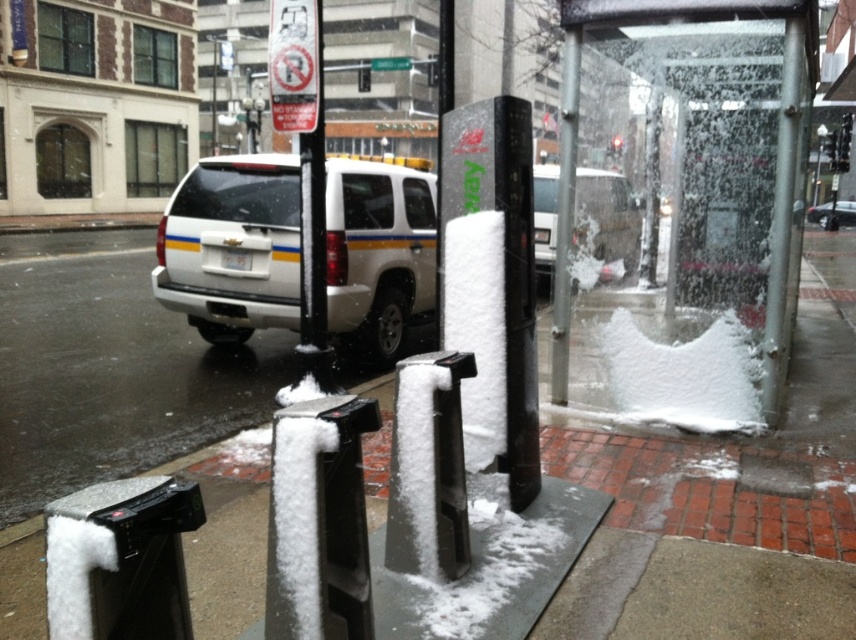
You are a delivery driver trying to park your vehicle in a narrow alley. You see a white matte suv at center and a white matte suv at upper center in the scene. Which one is wider and could block your path more if you try to park?

The white matte suv at center might be wider than white matte suv at upper center, so it could block your path more if you try to park.

In the scene shown: You are a delivery person needing to park your 1.8 meters tall delivery box next to the white frosted phone box at center. The parking spot is near the white matte suv at upper center. Can you fit your delivery box there without blocking the phone box?

The white frosted phone box at center is shorter than the white matte suv at upper center. Since your delivery box is 1.8 meters tall, it is possible that it may exceed the height of the phone box, potentially blocking it. Check the exact height of the phone box before placing the delivery box.

You are a delivery driver who needs to park your truck between the transparent glass bus stop at center and the white snow at lower left. Can you fit your truck there if your truck is 2.5 meters wide?

The transparent glass bus stop at center is thinner than white snow at lower left. Since the truck is 2.5 meters wide, it depends on the actual width between them. However, the description only states the bus stop is thinner, not the exact distance. Without specific measurements, it is impossible to determine if the truck will fit.